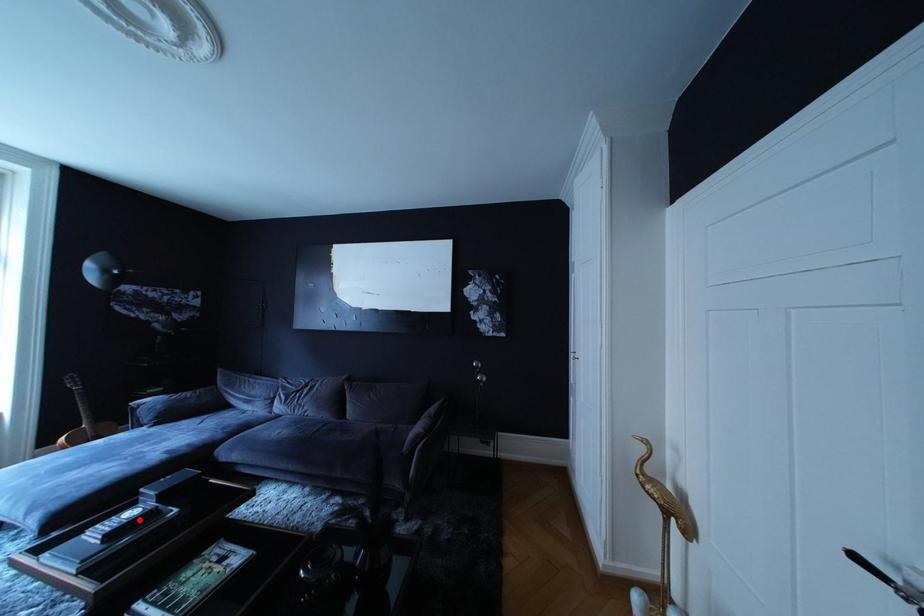
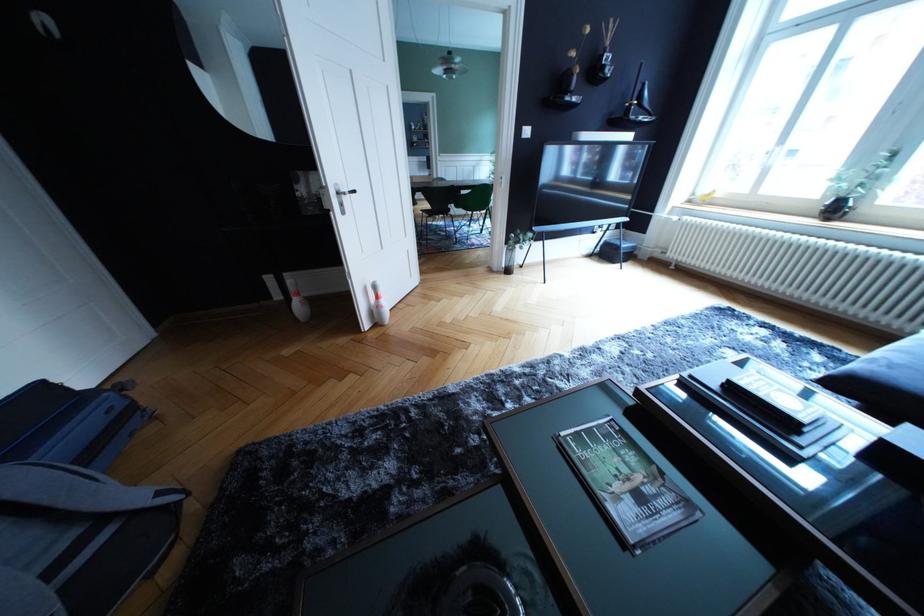
Question: I am providing you with two images of the same scene from different viewpoints. In image1, a red point is highlighted. Considering the same 3D point in image2, which of the following is correct?

Choices:
 (A) It is closer
 (B) It is farther

Answer: (B)